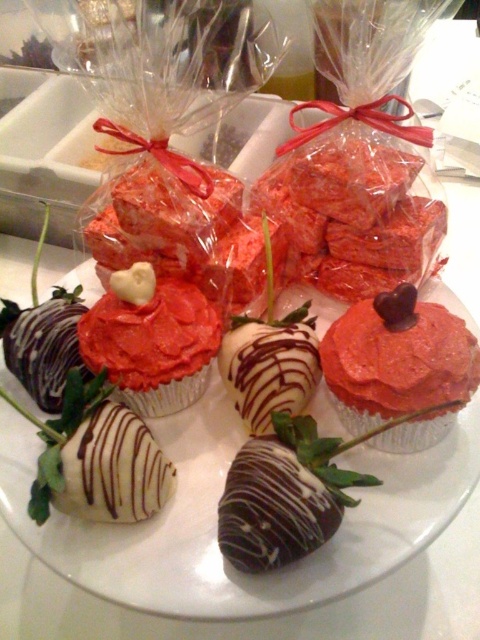
The width and height of the screenshot is (480, 640). In order to click on matte pink cupcake at center in this screenshot , I will do `click(396, 358)`.

Between matte pink cupcake at center and red velvet cake at center, which one appears on the right side from the viewer's perspective?

matte pink cupcake at center is more to the right.

Locate an element on the screen. This screenshot has height=640, width=480. matte pink cupcake at center is located at coordinates (396, 358).